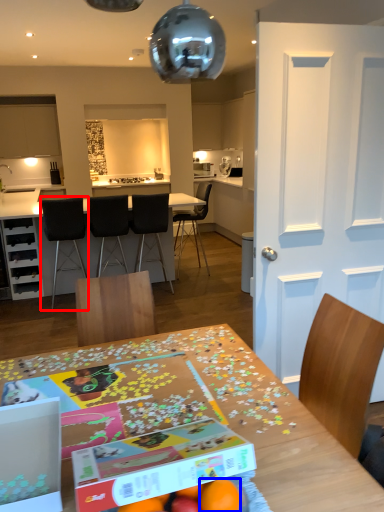
Question: Which object appears closest to the camera in this image, chair (highlighted by a red box) or orange (highlighted by a blue box)?

Choices:
 (A) chair
 (B) orange

Answer: (B)